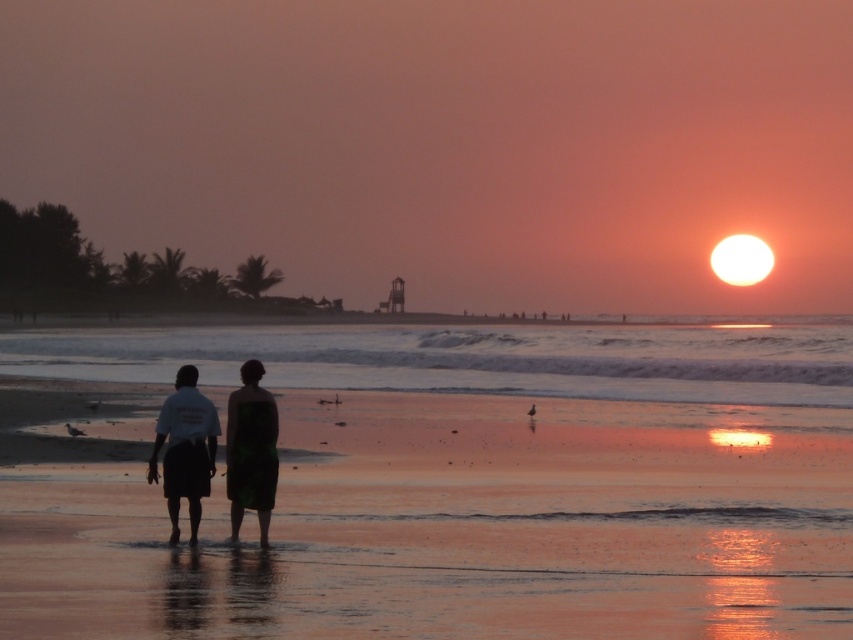
Does silhouette shorts at center appear on the right side of green textured towel at center?

No, silhouette shorts at center is not to the right of green textured towel at center.

Which is in front, point (183, 445) or point (265, 413)?

Positioned in front is point (265, 413).

Describe the element at coordinates (183, 449) in the screenshot. The width and height of the screenshot is (853, 640). I see `silhouette shorts at center` at that location.

Find the location of a particular element. The height and width of the screenshot is (640, 853). silhouette shorts at center is located at coordinates (183, 449).

Does reflective wet sand at center have a greater width compared to green textured towel at center?

Correct, the width of reflective wet sand at center exceeds that of green textured towel at center.

Can you confirm if reflective wet sand at center is positioned above green textured towel at center?

Yes, reflective wet sand at center is above green textured towel at center.

Where is `reflective wet sand at center`? The image size is (853, 640). reflective wet sand at center is located at coordinates (471, 358).

Does point (537, 368) come in front of point (250, 422)?

No, (537, 368) is further to viewer.

At what (x,y) coordinates should I click in order to perform the action: click on reflective wet sand at center. Please return your answer as a coordinate pair (x, y). Looking at the image, I should click on (471, 358).